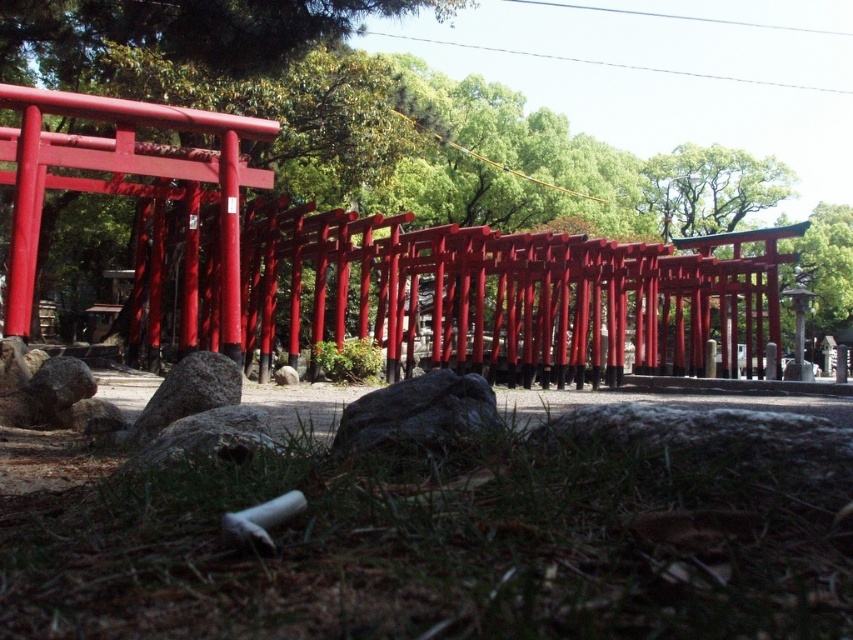
Question: Among these points, which one is nearest to the camera?

Choices:
 (A) (469, 460)
 (B) (619, 304)
 (C) (439, 408)
 (D) (218, 365)

Answer: (A)

Question: Is green grass at lower center bigger than gray rough rock at lower center?

Choices:
 (A) yes
 (B) no

Answer: (A)

Question: Based on their relative distances, which object is nearer to the gray rough rock at center?

Choices:
 (A) green grass at lower center
 (B) gray rough rock at lower center
 (C) smooth glossy torii gates at center

Answer: (A)

Question: Can you confirm if green grass at lower center is positioned to the left of smooth glossy torii gates at center?

Choices:
 (A) yes
 (B) no

Answer: (B)

Question: In this image, where is gray rough rock at center located relative to gray rough rock at lower center?

Choices:
 (A) right
 (B) left

Answer: (A)

Question: Which point is closer to the camera taking this photo?

Choices:
 (A) (169, 400)
 (B) (773, 620)
 (C) (96, 156)
 (D) (384, 406)

Answer: (B)